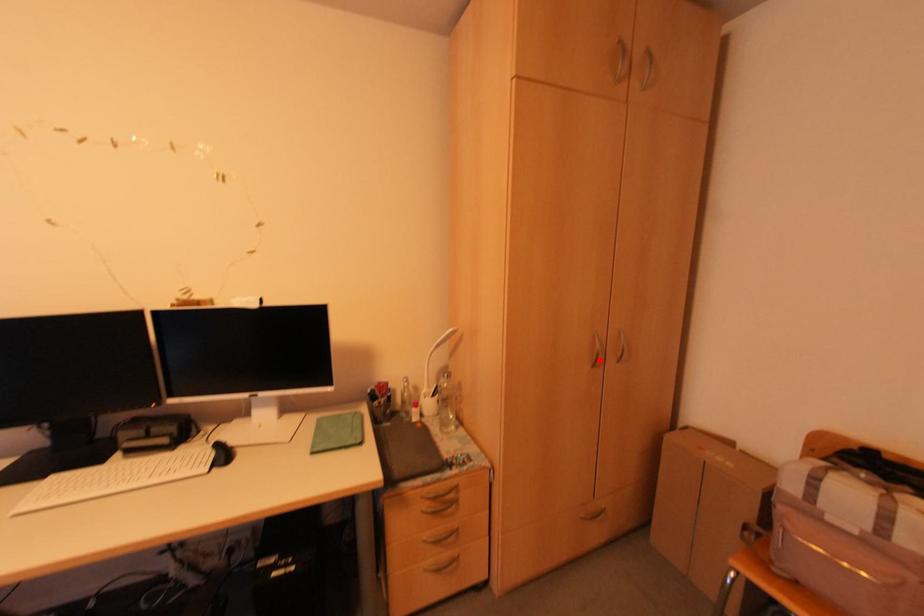
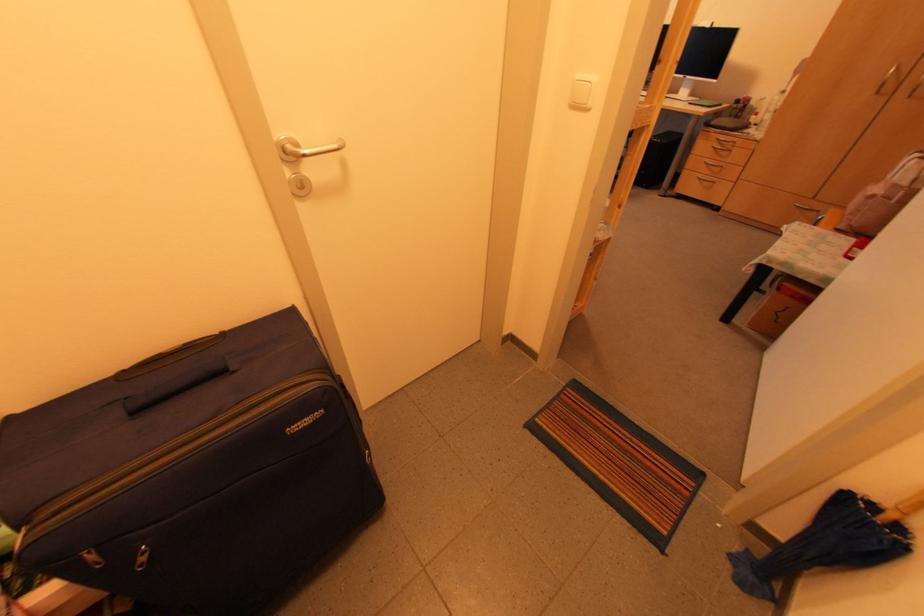
Where in the second image is the point corresponding to the highlighted location from the first image?

(886, 87)